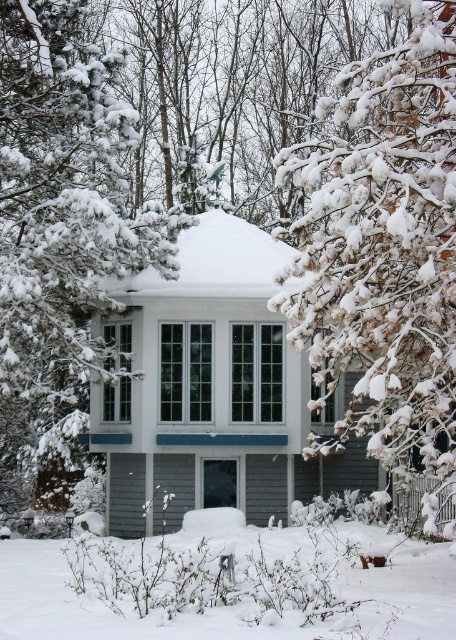
The image size is (456, 640). What do you see at coordinates (213, 392) in the screenshot?
I see `white matte gazebo at center` at bounding box center [213, 392].

Does white matte gazebo at center lie behind white fluffy snow at lower center?

Yes, white matte gazebo at center is behind white fluffy snow at lower center.

Does point (262, 401) lie behind point (50, 573)?

Yes, point (262, 401) is behind point (50, 573).

Find the location of a particular element. white matte gazebo at center is located at coordinates (213, 392).

Is snow-covered branches at upper right thinner than white fluffy snow at lower center?

Yes, snow-covered branches at upper right is thinner than white fluffy snow at lower center.

You are a GUI agent. You are given a task and a screenshot of the screen. Output one action in this format:
    pyautogui.click(x=<x>, y=<y>)
    Task: Click on the snow-covered branches at upper right
    The height and width of the screenshot is (640, 456).
    Given the screenshot: What is the action you would take?
    pyautogui.click(x=384, y=252)

This screenshot has width=456, height=640. Describe the element at coordinates (384, 252) in the screenshot. I see `snow-covered branches at upper right` at that location.

You are a GUI agent. You are given a task and a screenshot of the screen. Output one action in this format:
    pyautogui.click(x=<x>, y=<y>)
    Task: Click on the snow-covered branches at upper right
    Image resolution: width=456 pixels, height=640 pixels.
    Given the screenshot: What is the action you would take?
    pyautogui.click(x=384, y=252)

Does point (43, 243) come in front of point (207, 627)?

That is False.

You are a GUI agent. You are given a task and a screenshot of the screen. Output one action in this format:
    pyautogui.click(x=<x>, y=<y>)
    Task: Click on the snow-covered pine tree at center
    The width and height of the screenshot is (456, 640).
    Given the screenshot: What is the action you would take?
    pyautogui.click(x=62, y=212)

The height and width of the screenshot is (640, 456). I want to click on snow-covered pine tree at center, so click(62, 212).